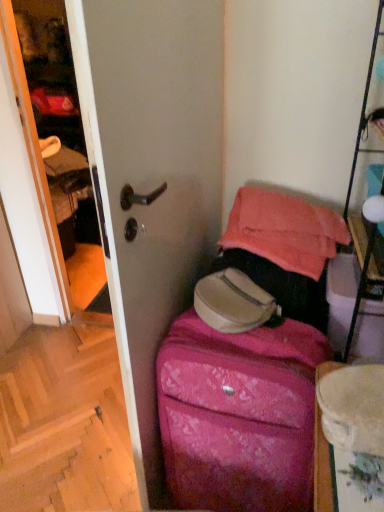
Question: Does wooden at lower left lie in front of pink fabric suitcase at lower right?

Choices:
 (A) no
 (B) yes

Answer: (A)

Question: Does wooden at lower left have a greater height compared to pink fabric suitcase at lower right?

Choices:
 (A) no
 (B) yes

Answer: (A)

Question: Is wooden at lower left turned away from pink fabric suitcase at lower right?

Choices:
 (A) no
 (B) yes

Answer: (A)

Question: From a real-world perspective, is wooden at lower left physically above pink fabric suitcase at lower right?

Choices:
 (A) no
 (B) yes

Answer: (A)

Question: Is wooden at lower left aimed at pink fabric suitcase at lower right?

Choices:
 (A) yes
 (B) no

Answer: (B)

Question: Does wooden at lower left have a smaller size compared to pink fabric suitcase at lower right?

Choices:
 (A) no
 (B) yes

Answer: (B)

Question: Could you tell me if pink textured suitcase at center is facing pink fabric suitcase at lower right?

Choices:
 (A) yes
 (B) no

Answer: (B)

Question: Is the surface of pink textured suitcase at center in direct contact with pink fabric suitcase at lower right?

Choices:
 (A) yes
 (B) no

Answer: (B)

Question: Does pink textured suitcase at center come behind pink fabric suitcase at lower right?

Choices:
 (A) yes
 (B) no

Answer: (A)

Question: Is pink textured suitcase at center smaller than pink fabric suitcase at lower right?

Choices:
 (A) no
 (B) yes

Answer: (B)

Question: Is pink textured suitcase at center shorter than pink fabric suitcase at lower right?

Choices:
 (A) no
 (B) yes

Answer: (B)

Question: Is pink textured suitcase at center completely or partially outside of pink fabric suitcase at lower right?

Choices:
 (A) yes
 (B) no

Answer: (A)

Question: Is pink textured suitcase at center not near wooden at lower left?

Choices:
 (A) yes
 (B) no

Answer: (B)